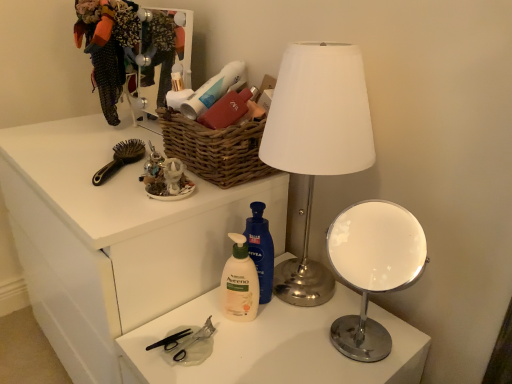
Identify the location of vacant space situated on the left part of chrome/metallic table lamp at right. (284, 342).